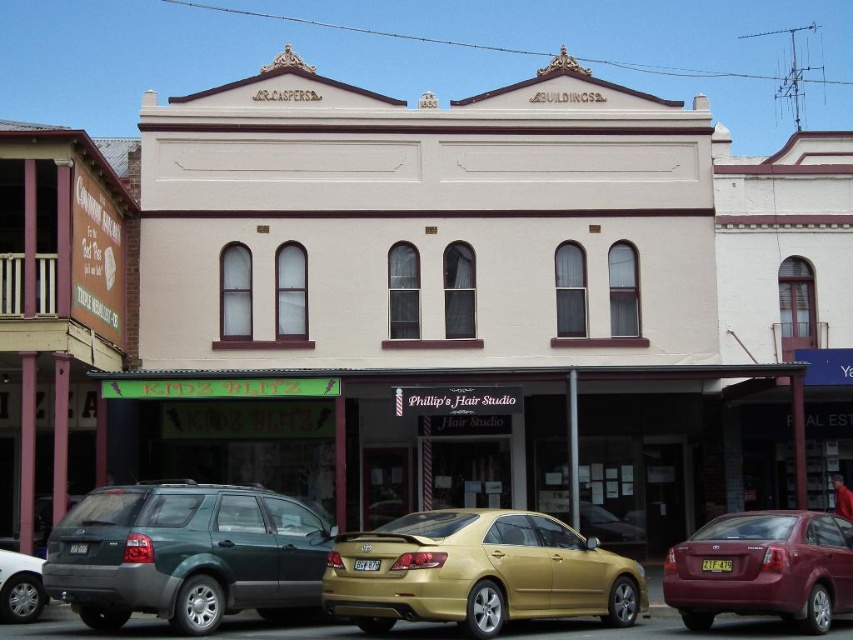
Can you confirm if maroon metallic sedan at lower right is thinner than silver metallic sedan at lower left?

No, maroon metallic sedan at lower right is not thinner than silver metallic sedan at lower left.

Is maroon metallic sedan at lower right to the right of silver metallic sedan at lower left from the viewer's perspective?

Indeed, maroon metallic sedan at lower right is positioned on the right side of silver metallic sedan at lower left.

The image size is (853, 640). Identify the location of maroon metallic sedan at lower right. (762, 568).

This screenshot has height=640, width=853. I want to click on maroon metallic sedan at lower right, so click(x=762, y=568).

Can you confirm if green matte suv at lower left is positioned above maroon metallic sedan at lower right?

Yes.

Who is more distant from viewer, (283, 598) or (746, 524)?

Positioned behind is point (746, 524).

Does point (238, 596) come in front of point (672, 588)?

That is True.

Locate an element on the screen. This screenshot has width=853, height=640. green matte suv at lower left is located at coordinates (186, 554).

Does gold metallic sedan at center have a lesser width compared to maroon metallic sedan at lower right?

In fact, gold metallic sedan at center might be wider than maroon metallic sedan at lower right.

From the picture: Who is positioned more to the left, gold metallic sedan at center or maroon metallic sedan at lower right?

From the viewer's perspective, gold metallic sedan at center appears more on the left side.

You are a GUI agent. You are given a task and a screenshot of the screen. Output one action in this format:
    pyautogui.click(x=<x>, y=<y>)
    Task: Click on the gold metallic sedan at center
    The height and width of the screenshot is (640, 853).
    Given the screenshot: What is the action you would take?
    pyautogui.click(x=477, y=572)

At what (x,y) coordinates should I click in order to perform the action: click on gold metallic sedan at center. Please return your answer as a coordinate pair (x, y). The height and width of the screenshot is (640, 853). Looking at the image, I should click on (477, 572).